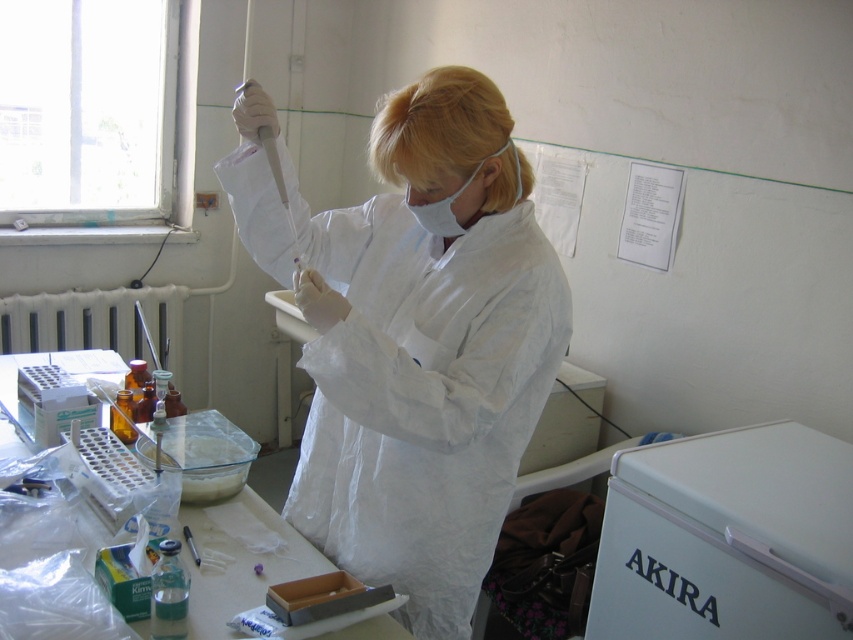
Question: Considering the relative positions of white plastic refrigerator at lower right and white plastic radiator at left in the image provided, where is white plastic refrigerator at lower right located with respect to white plastic radiator at left?

Choices:
 (A) left
 (B) right

Answer: (B)

Question: Which point is farther to the camera?

Choices:
 (A) (16, 438)
 (B) (780, 432)

Answer: (B)

Question: Is white paper lab coat at center closer to the viewer compared to clear plastic tray at center?

Choices:
 (A) no
 (B) yes

Answer: (B)

Question: Among these points, which one is nearest to the camera?

Choices:
 (A) (479, 536)
 (B) (27, 320)
 (C) (837, 627)
 (D) (10, 403)

Answer: (C)

Question: Is white paper lab coat at center closer to camera compared to white plastic radiator at left?

Choices:
 (A) no
 (B) yes

Answer: (B)

Question: Among these objects, which one is nearest to the camera?

Choices:
 (A) white plastic radiator at left
 (B) white plastic refrigerator at lower right

Answer: (B)